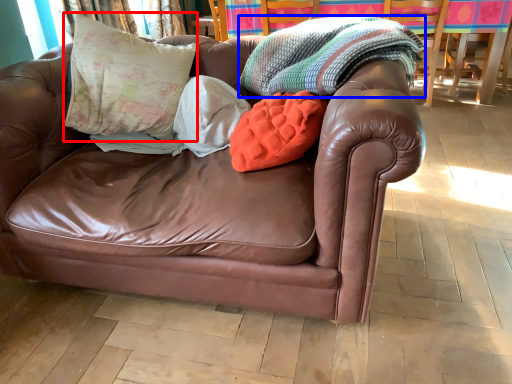
Question: Which object is further to the camera taking this photo, pillow (highlighted by a red box) or blanket (highlighted by a blue box)?

Choices:
 (A) pillow
 (B) blanket

Answer: (A)